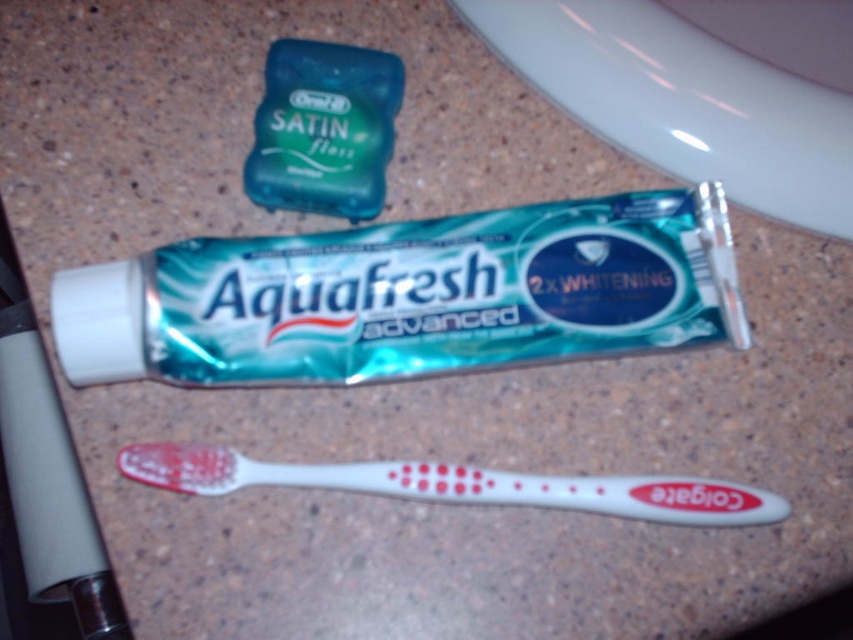
You are organizing the bathroom countertop and need to place a new item between the green glossy toothpaste at center and the white plastic toothbrush at lower center. Considering their heights, which item should be placed on the bottom shelf to ensure stability?

The white plastic toothbrush at lower center should be placed on the bottom shelf because it is shorter than the green glossy toothpaste at center, allowing the taller toothpaste to sit securely on top.

You are holding a smartphone camera 24 inches away from the bathroom countertop. You want to take a photo of the green glossy toothpaste at center. Is the toothpaste currently in focus if your camera has a depth of field that can only sharply focus objects within 26 inches from the lens?

The green glossy toothpaste at center is 28.47 inches away from the camera, which is beyond the 26 inches depth of field range. Therefore, the toothpaste will not be in focus.

You are organizing the bathroom items and want to place the green glossy toothpaste at center to the right of the white plastic toothbrush at lower center. Is the current arrangement correct?

The green glossy toothpaste at center is currently positioned on the left side of the white plastic toothbrush at lower center, so the current arrangement is not correct as you want it to the right.